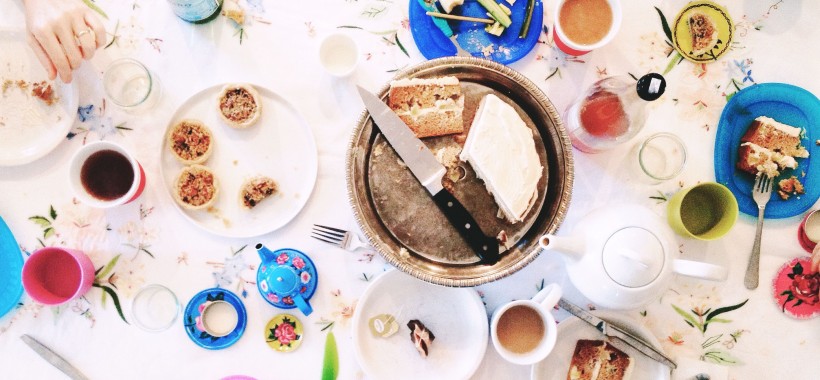
Identify the location of plate. (447, 341).